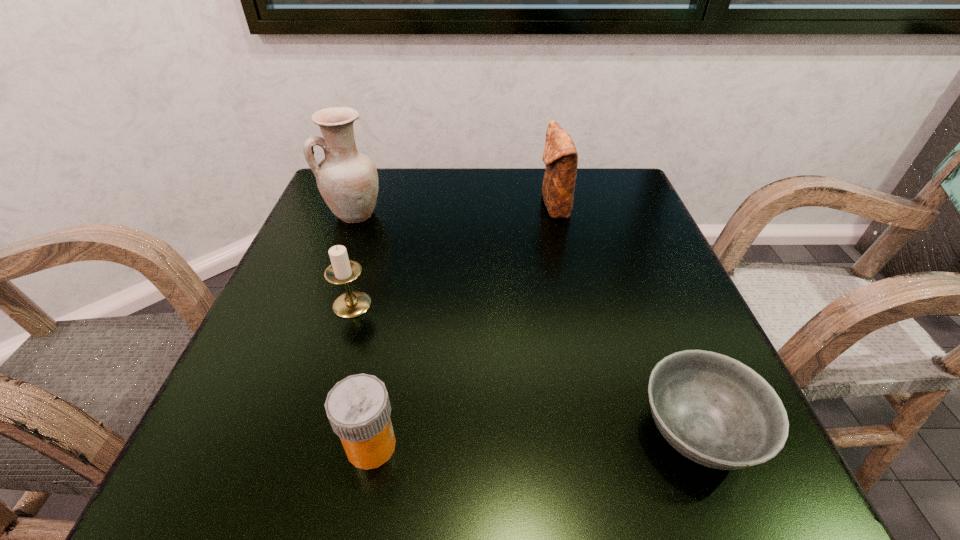
The width and height of the screenshot is (960, 540). Find the location of `free space at the near left corner of the desktop`. free space at the near left corner of the desktop is located at coordinates (267, 495).

Locate an element on the screen. The width and height of the screenshot is (960, 540). free space between the fourth object from left to right and the tallest object is located at coordinates (454, 210).

Image resolution: width=960 pixels, height=540 pixels. Identify the location of vacant area that lies between the second object from right to left and the candle holder. (453, 255).

Identify the location of free space between the fourth shortest object and the third shortest object. The height and width of the screenshot is (540, 960). (453, 255).

Locate an element on the screen. free space between the third object from right to left and the clutch bag is located at coordinates (463, 326).

The height and width of the screenshot is (540, 960). Identify the location of free spot between the pottery and the third farthest object. (353, 260).

At what (x,y) coordinates should I click in order to perform the action: click on unoccupied area between the third nearest object and the clutch bag. Please return your answer as a coordinate pair (x, y). Image resolution: width=960 pixels, height=540 pixels. Looking at the image, I should click on (453, 255).

Identify the location of unoccupied position between the third nearest object and the shortest object. (524, 368).

I want to click on free spot between the tallest object and the shortest object, so click(x=526, y=323).

Where is `free point between the third nearest object and the second object from right to left`? The height and width of the screenshot is (540, 960). free point between the third nearest object and the second object from right to left is located at coordinates (453, 255).